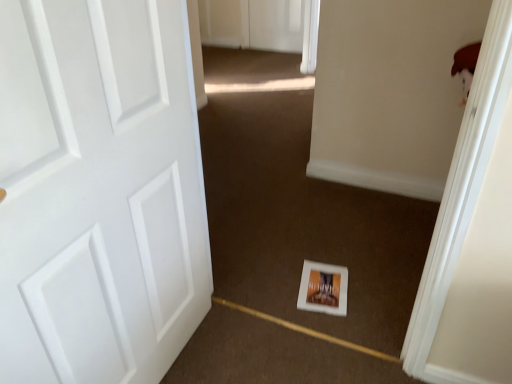
The width and height of the screenshot is (512, 384). I want to click on blank area to the left of white matte postcard at center, so click(275, 292).